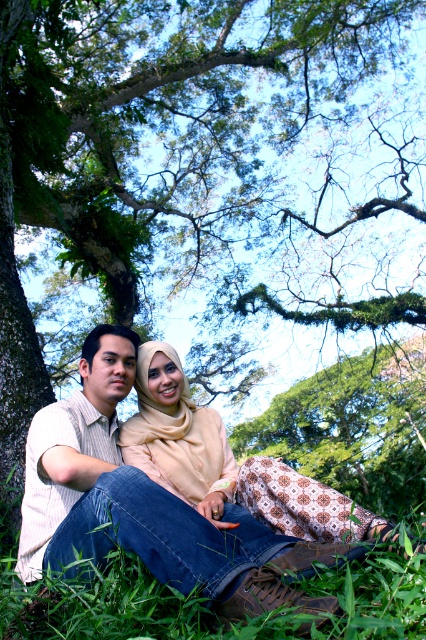
You are standing at the origin point in the scene. Which of the two points, point (92, 332) or point (63, 600), is closer to you?

Point (63, 600) is closer to you because it is in front of point (92, 332).

You are a photographer trying to capture the denim jeans at lower center and the green grass at lower center in a closeup shot. Which object is directly touching the ground?

The green grass at lower center is directly touching the ground because the denim jeans at lower center is positioned over it.